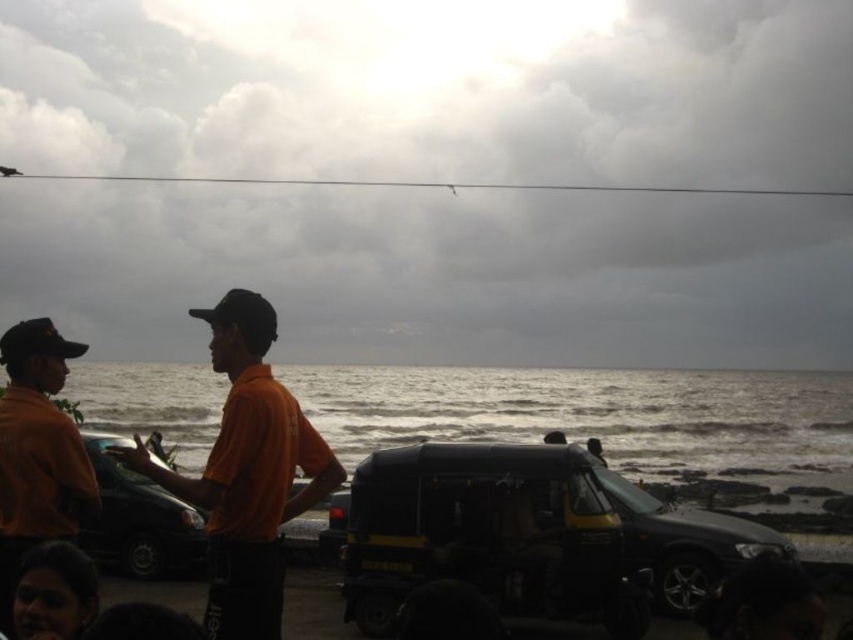
Which of these two, black matte jeep at center or orange matte shirt at lower left, stands taller?

orange matte shirt at lower left is taller.

Is black matte jeep at center taller than orange matte shirt at lower left?

Incorrect, black matte jeep at center's height is not larger of orange matte shirt at lower left's.

The image size is (853, 640). I want to click on black matte jeep at center, so click(531, 536).

Is black matte jeep at center above shiny black car at left?

No.

Is black matte jeep at center positioned in front of shiny black car at left?

No, black matte jeep at center is behind shiny black car at left.

Is point (370, 468) positioned before point (126, 484)?

Yes.

Locate an element on the screen. black matte jeep at center is located at coordinates (531, 536).

Does orange matte shirt at lower left have a smaller size compared to shiny black car at left?

Yes.

Can you confirm if orange matte shirt at lower left is shorter than shiny black car at left?

Yes.

In the scene shown: Who is more distant from viewer, (68, 433) or (184, 545)?

The point (184, 545) is more distant.

Locate an element on the screen. The height and width of the screenshot is (640, 853). orange matte shirt at lower left is located at coordinates (38, 452).